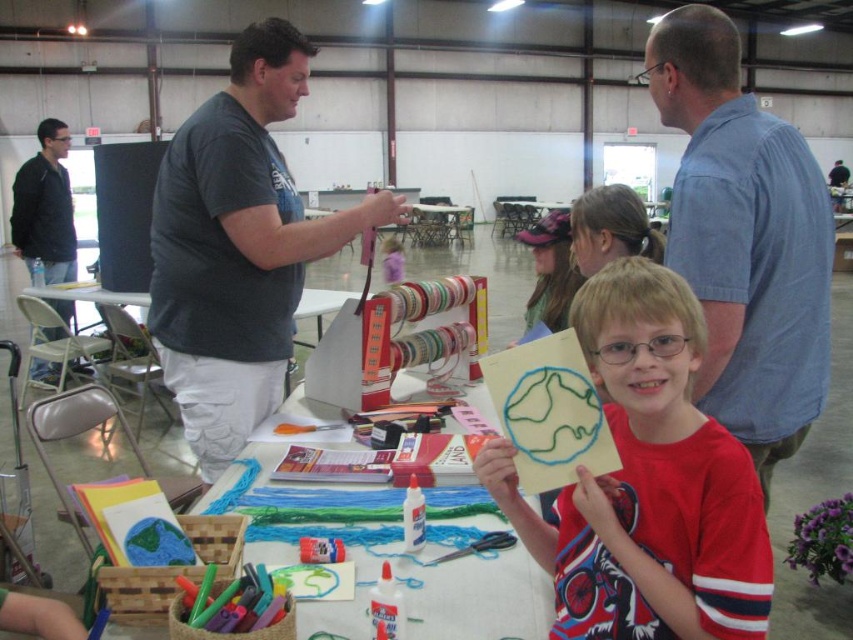
Question: Which point is farther to the camera?

Choices:
 (A) (815, 364)
 (B) (273, 248)

Answer: (B)

Question: Is white paper at center positioned at the back of matte pink cap at upper center?

Choices:
 (A) no
 (B) yes

Answer: (A)

Question: Does blue striped shirt at upper right have a greater width compared to dark gray t-shirt at center?

Choices:
 (A) no
 (B) yes

Answer: (A)

Question: Is dark gray t-shirt at center below dark gray t-shirt at left?

Choices:
 (A) no
 (B) yes

Answer: (B)

Question: Which object appears closest to the camera in this image?

Choices:
 (A) blue striped shirt at upper right
 (B) red matte paper at center
 (C) white plastic table at center
 (D) dark gray t-shirt at center

Answer: (B)

Question: Which of the following is the farthest from the observer?

Choices:
 (A) blue striped shirt at upper right
 (B) dark gray t-shirt at left
 (C) red matte paper at center
 (D) white paper at center

Answer: (B)